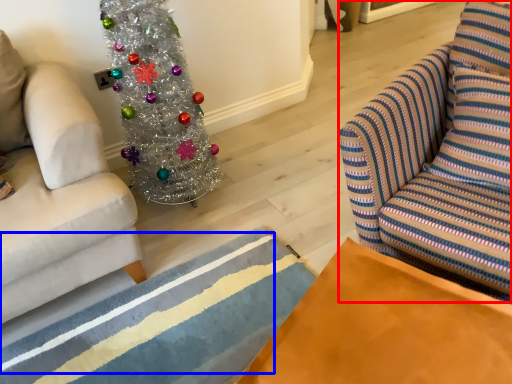
Question: Which object appears closest to the camera in this image, swivel chair (highlighted by a red box) or stripe (highlighted by a blue box)?

Choices:
 (A) swivel chair
 (B) stripe

Answer: (A)